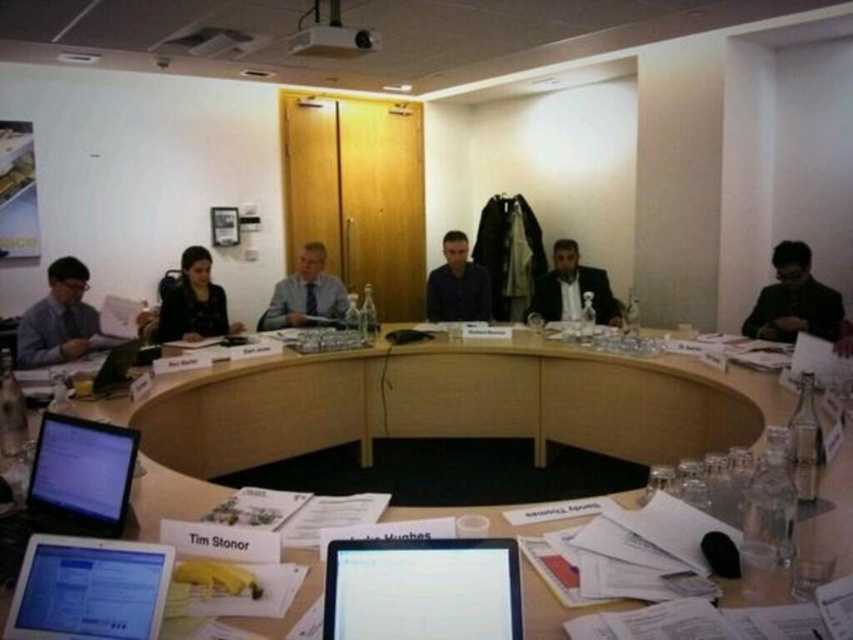
Looking at this image, who is taller, white glossy laptop at center or matte blue shirt at center?

With more height is matte blue shirt at center.

Can you confirm if white glossy laptop at center is shorter than matte blue shirt at center?

Indeed, white glossy laptop at center has a lesser height compared to matte blue shirt at center.

I want to click on white glossy laptop at center, so click(x=422, y=589).

Is white glossy laptop at center to the right of silver metallic tablet at lower left from the viewer's perspective?

Indeed, white glossy laptop at center is positioned on the right side of silver metallic tablet at lower left.

Find the location of a particular element. white glossy laptop at center is located at coordinates (422, 589).

This screenshot has width=853, height=640. I want to click on white glossy laptop at center, so click(422, 589).

From the picture: Does silver metallic tablet at lower left have a smaller size compared to silver metallic laptop at lower left?

Yes.

Between point (67, 560) and point (1, 541), which one is positioned in front?

Positioned in front is point (67, 560).

Find the location of a particular element. The image size is (853, 640). silver metallic tablet at lower left is located at coordinates (90, 589).